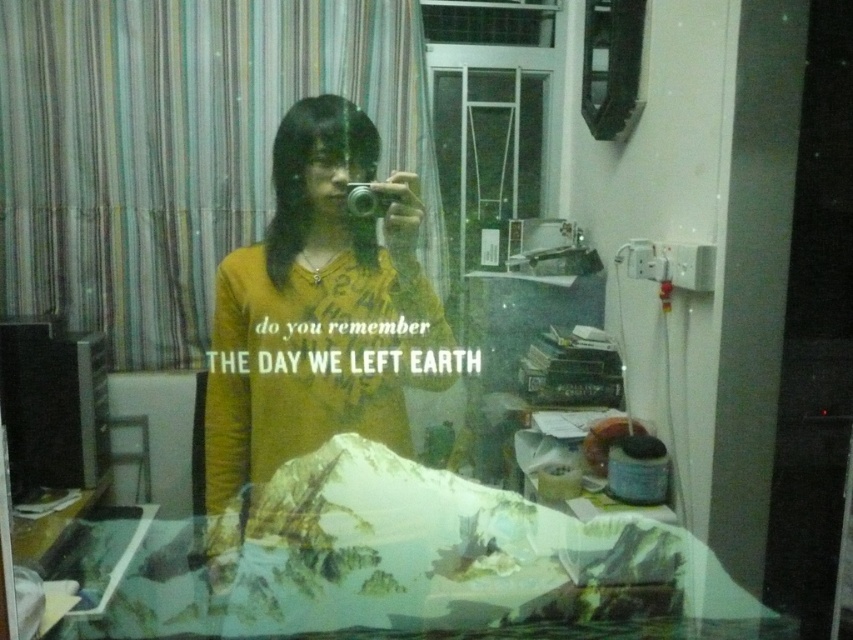
You are a photographer analyzing the reflection in the mirror. You notice the yellow matte shirt at center and the matte black camera at center. Which object is positioned lower in the reflection?

The yellow matte shirt at center is positioned lower than the matte black camera at center in the reflection.

You are trying to take a photo of the yellow matte shirt at center and the matte black camera at center through the reflective surface. Which object will appear larger in your photo?

The yellow matte shirt at center will appear larger in the photo because it is closer to the viewer than the matte black camera at center.

You are trying to determine if the yellow matte shirt at center can fully cover the matte black camera at center when placed side by side. Based on their sizes, is this possible?

The yellow matte shirt at center has a larger width than the matte black camera at center, so it can fully cover the matte black camera at center when placed side by side.